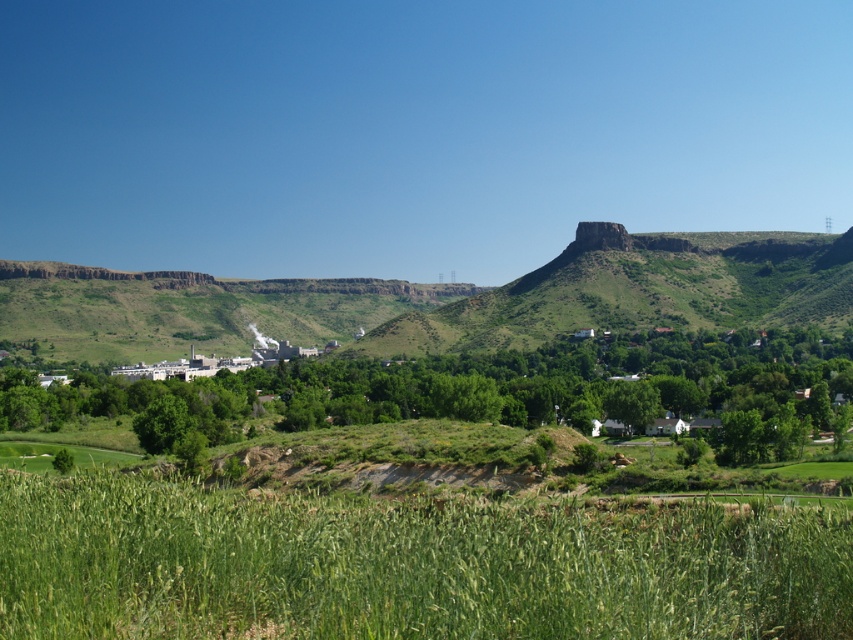
Question: Does green grassy field at lower center appear over white industrial building at center?

Choices:
 (A) yes
 (B) no

Answer: (A)

Question: Which of the following is the closest to the observer?

Choices:
 (A) (811, 577)
 (B) (329, 348)

Answer: (A)

Question: Can you confirm if green grassy field at lower center is positioned to the right of white industrial building at center?

Choices:
 (A) yes
 (B) no

Answer: (A)

Question: Does green grassy field at lower center have a smaller size compared to white industrial building at center?

Choices:
 (A) no
 (B) yes

Answer: (B)

Question: Which object is closer to the camera taking this photo?

Choices:
 (A) white industrial building at center
 (B) green grassy field at lower center

Answer: (B)

Question: Which point is farther to the camera?

Choices:
 (A) (486, 577)
 (B) (155, 378)

Answer: (B)